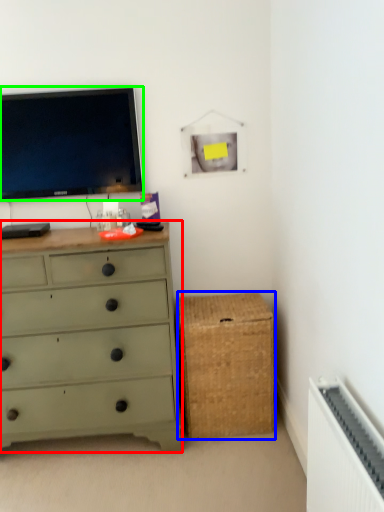
Question: Which is nearer to the chest of drawers (highlighted by a red box)? storage box (highlighted by a blue box) or television (highlighted by a green box).

Choices:
 (A) storage box
 (B) television

Answer: (A)